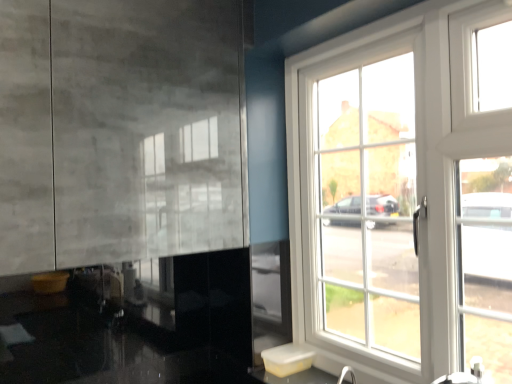
Question: Is white glass window at right placed right next to white glossy sink at lower right?

Choices:
 (A) no
 (B) yes

Answer: (A)

Question: Is white glass window at right shorter than white glossy sink at lower right?

Choices:
 (A) no
 (B) yes

Answer: (A)

Question: Is white glass window at right to the left of white glossy sink at lower right from the viewer's perspective?

Choices:
 (A) yes
 (B) no

Answer: (B)

Question: Considering the relative positions of white glass window at right and white glossy sink at lower right in the image provided, is white glass window at right in front of white glossy sink at lower right?

Choices:
 (A) no
 (B) yes

Answer: (A)

Question: From the image's perspective, is white glass window at right located above white glossy sink at lower right?

Choices:
 (A) yes
 (B) no

Answer: (A)

Question: Is white glass window at right behind white glossy sink at lower right?

Choices:
 (A) no
 (B) yes

Answer: (B)

Question: Is the position of white glossy sink at lower right less distant than that of white glass window at right?

Choices:
 (A) yes
 (B) no

Answer: (A)

Question: Can you confirm if white glossy sink at lower right is wider than white glass window at right?

Choices:
 (A) no
 (B) yes

Answer: (B)

Question: Is white glossy sink at lower right at the right side of white glass window at right?

Choices:
 (A) no
 (B) yes

Answer: (A)

Question: From the image's perspective, is white glossy sink at lower right under white glass window at right?

Choices:
 (A) yes
 (B) no

Answer: (A)

Question: Is white glossy sink at lower right oriented towards white glass window at right?

Choices:
 (A) yes
 (B) no

Answer: (B)

Question: Is the position of white glossy sink at lower right more distant than that of white glass window at right?

Choices:
 (A) no
 (B) yes

Answer: (A)

Question: From the image's perspective, is white glossy sink at lower right above or below white glass window at right?

Choices:
 (A) below
 (B) above

Answer: (A)